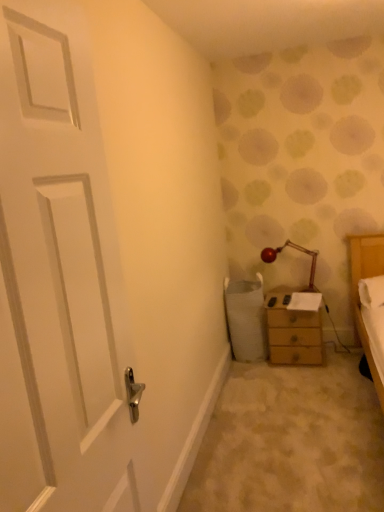
Question: From a real-world perspective, is matte red lamp at upper right positioned over white matte door at left based on gravity?

Choices:
 (A) yes
 (B) no

Answer: (B)

Question: Does matte red lamp at upper right have a greater height compared to white matte door at left?

Choices:
 (A) no
 (B) yes

Answer: (A)

Question: From the image's perspective, is matte red lamp at upper right over white matte door at left?

Choices:
 (A) yes
 (B) no

Answer: (A)

Question: Is matte red lamp at upper right looking in the opposite direction of white matte door at left?

Choices:
 (A) no
 (B) yes

Answer: (A)

Question: Is matte red lamp at upper right behind white matte door at left?

Choices:
 (A) yes
 (B) no

Answer: (A)

Question: Do you think white matte door at left is within matte red lamp at upper right, or outside of it?

Choices:
 (A) outside
 (B) inside

Answer: (A)

Question: Looking at their shapes, would you say white matte door at left is wider or thinner than matte red lamp at upper right?

Choices:
 (A) wide
 (B) thin

Answer: (B)

Question: From the image's perspective, is white matte door at left above or below matte red lamp at upper right?

Choices:
 (A) above
 (B) below

Answer: (B)

Question: In terms of height, does white matte door at left look taller or shorter compared to matte red lamp at upper right?

Choices:
 (A) tall
 (B) short

Answer: (A)

Question: In terms of size, does matte red lamp at upper right appear bigger or smaller than wooden chest of drawers at right?

Choices:
 (A) small
 (B) big

Answer: (A)

Question: Choose the correct answer: Is matte red lamp at upper right inside wooden chest of drawers at right or outside it?

Choices:
 (A) outside
 (B) inside

Answer: (A)

Question: From a real-world perspective, is matte red lamp at upper right physically located above or below wooden chest of drawers at right?

Choices:
 (A) below
 (B) above

Answer: (B)

Question: Is point (309, 272) closer or farther from the camera than point (279, 339)?

Choices:
 (A) closer
 (B) farther

Answer: (B)

Question: From a real-world perspective, is white matte door at left positioned above or below wooden chest of drawers at right?

Choices:
 (A) above
 (B) below

Answer: (A)

Question: Is white matte door at left taller or shorter than wooden chest of drawers at right?

Choices:
 (A) tall
 (B) short

Answer: (A)